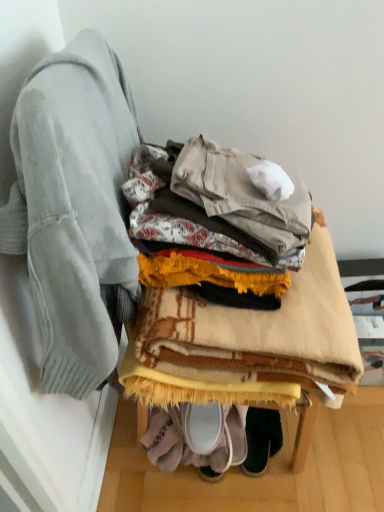
Question: Is light gray sweater at left positioned beyond the bounds of dark green suede shoes at lower center?

Choices:
 (A) yes
 (B) no

Answer: (A)

Question: Can you confirm if light gray sweater at left is taller than dark green suede shoes at lower center?

Choices:
 (A) no
 (B) yes

Answer: (B)

Question: Is the position of light gray sweater at left more distant than that of dark green suede shoes at lower center?

Choices:
 (A) no
 (B) yes

Answer: (A)

Question: From the image's perspective, is light gray sweater at left on top of dark green suede shoes at lower center?

Choices:
 (A) no
 (B) yes

Answer: (B)

Question: Can you confirm if light gray sweater at left is positioned to the left of dark green suede shoes at lower center?

Choices:
 (A) yes
 (B) no

Answer: (A)

Question: Does light gray sweater at left have a lesser width compared to dark green suede shoes at lower center?

Choices:
 (A) no
 (B) yes

Answer: (B)

Question: Considering the relative sizes of dark green suede shoes at lower center and light gray sweater at left in the image provided, is dark green suede shoes at lower center bigger than light gray sweater at left?

Choices:
 (A) yes
 (B) no

Answer: (B)

Question: Would you say dark green suede shoes at lower center contains light gray sweater at left?

Choices:
 (A) no
 (B) yes

Answer: (A)

Question: Does dark green suede shoes at lower center lie behind light gray sweater at left?

Choices:
 (A) yes
 (B) no

Answer: (A)

Question: From a real-world perspective, does dark green suede shoes at lower center sit lower than light gray sweater at left?

Choices:
 (A) no
 (B) yes

Answer: (B)

Question: Is dark green suede shoes at lower center to the left of light gray sweater at left from the viewer's perspective?

Choices:
 (A) yes
 (B) no

Answer: (B)

Question: Considering the relative sizes of dark green suede shoes at lower center and light gray sweater at left in the image provided, is dark green suede shoes at lower center smaller than light gray sweater at left?

Choices:
 (A) yes
 (B) no

Answer: (A)

Question: Is light gray sweater at left positioned far away from beige woven blanket at center?

Choices:
 (A) yes
 (B) no

Answer: (B)